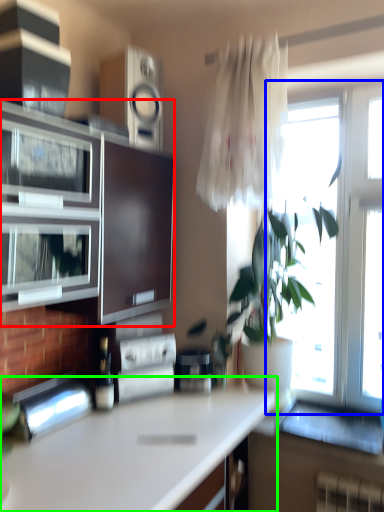
Question: Which is farther away from cabinetry (highlighted by a red box)? window (highlighted by a blue box) or countertop (highlighted by a green box)?

Choices:
 (A) window
 (B) countertop

Answer: (A)